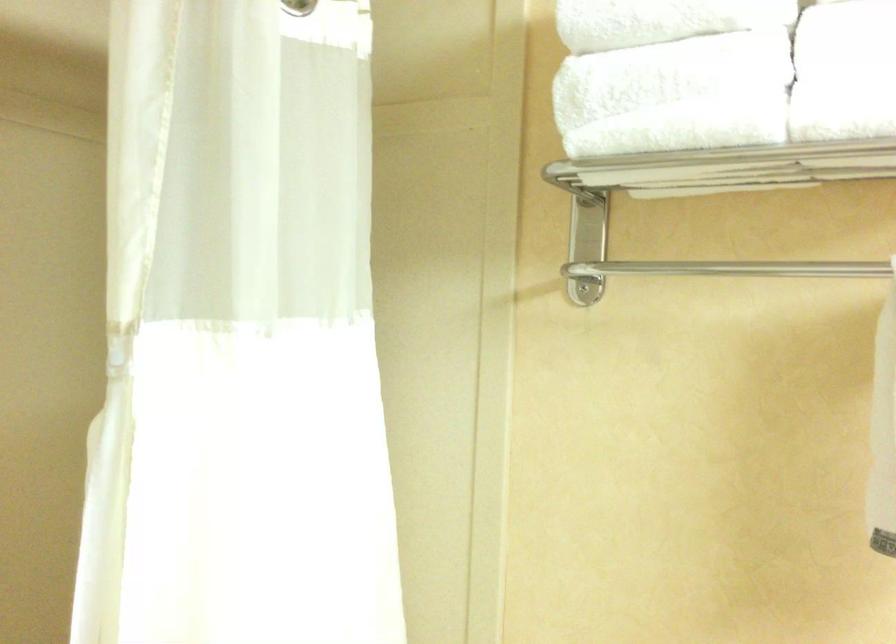
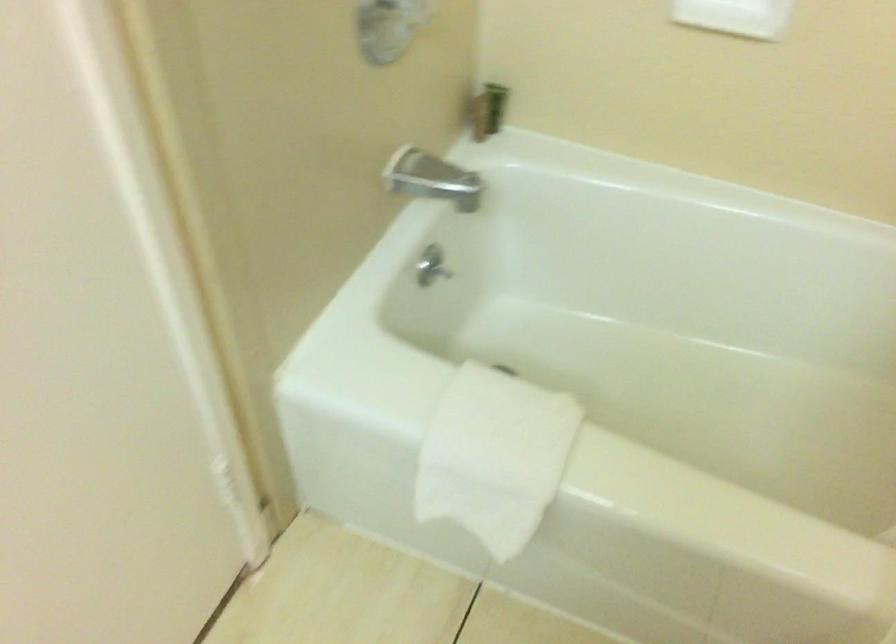
The first image is from the beginning of the video and the second image is from the end. How did the camera likely rotate when shooting the video?

The rotation direction of the camera is left-down.